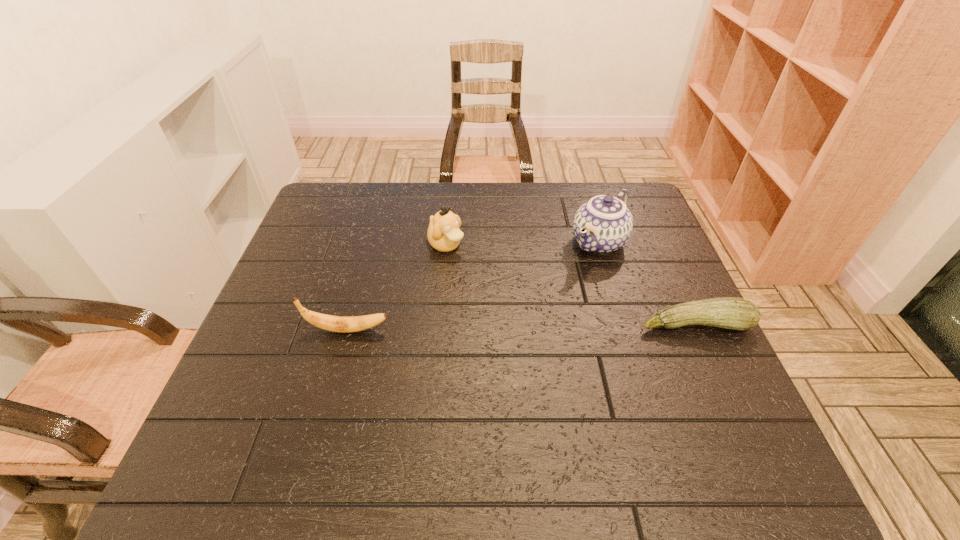
Find the location of a particular element. The image size is (960, 540). the second shortest object is located at coordinates [332, 323].

The image size is (960, 540). Find the location of `the leftmost object`. the leftmost object is located at coordinates (332, 323).

Where is `zucchini`? zucchini is located at coordinates (734, 313).

I want to click on the third object from right to left, so click(444, 235).

Identify the location of duckling. (444, 235).

The height and width of the screenshot is (540, 960). I want to click on chinaware, so click(604, 224).

What are the coordinates of `vacant space located 0.050m on the peel of the third tallest object from the top` in the screenshot? It's located at (412, 330).

At what (x,y) coordinates should I click in order to perform the action: click on vacant space situated at the stem end of the zucchini. Please return your answer as a coordinate pair (x, y). Looking at the image, I should click on (738, 418).

The width and height of the screenshot is (960, 540). What are the coordinates of `vacant space situated 0.250m on the face of the second tallest object` in the screenshot? It's located at (521, 307).

Where is `vacant space located 0.090m on the face of the second tallest object`? Image resolution: width=960 pixels, height=540 pixels. vacant space located 0.090m on the face of the second tallest object is located at coordinates (479, 272).